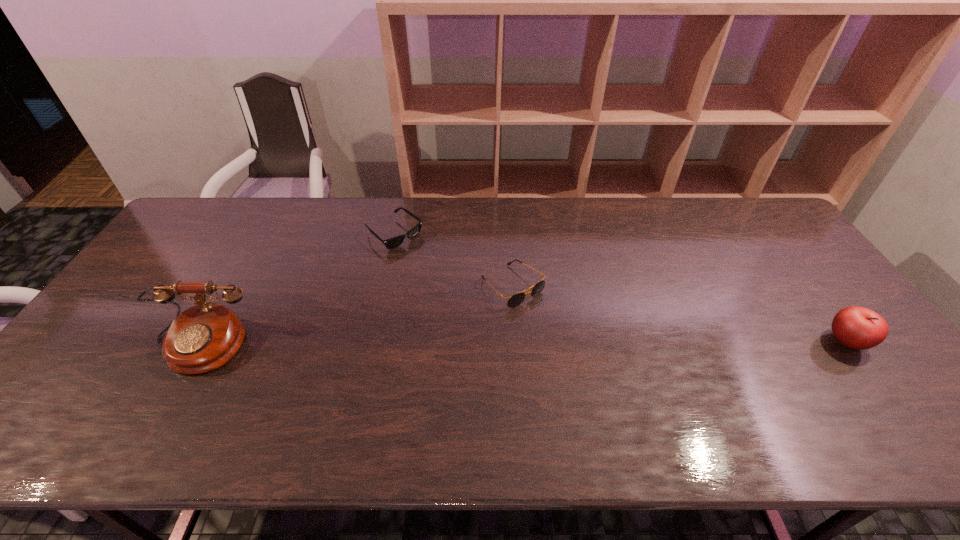
Where is `vacant spot on the desktop that is between the leftmost object and the third shortest object and is positioned on the front-facing side of the farther sunglasses`? vacant spot on the desktop that is between the leftmost object and the third shortest object and is positioned on the front-facing side of the farther sunglasses is located at coordinates (533, 343).

You are a GUI agent. You are given a task and a screenshot of the screen. Output one action in this format:
    pyautogui.click(x=<x>, y=<y>)
    Task: Click on the free spot on the desktop that is between the telephone and the apple and is positioned on the lenses of the second object from right to left
    This screenshot has height=540, width=960.
    Given the screenshot: What is the action you would take?
    pyautogui.click(x=572, y=343)